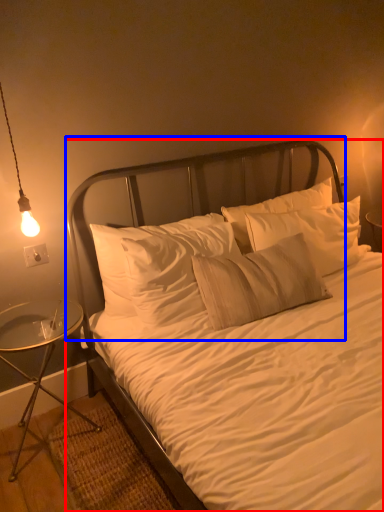
Question: Which point is closer to the camera, bed (highlighted by a red box) or headboard (highlighted by a blue box)?

Choices:
 (A) bed
 (B) headboard

Answer: (A)